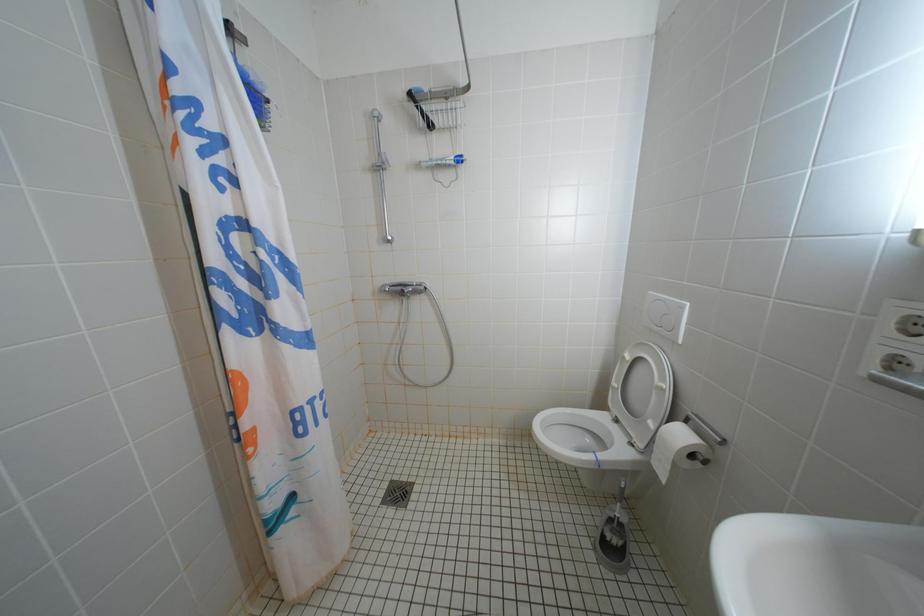
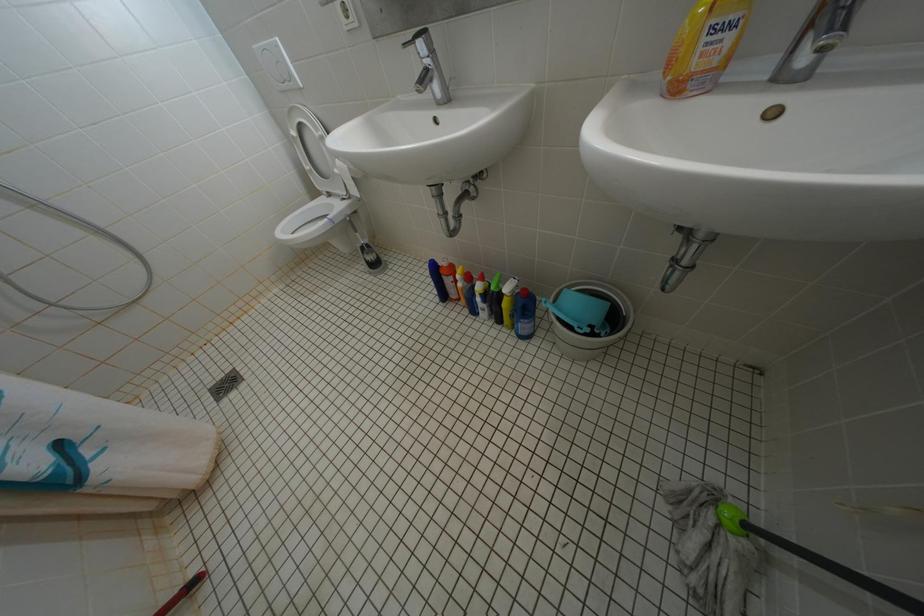
In the scene shown: How did the camera likely rotate?

The camera rotated toward right-down.